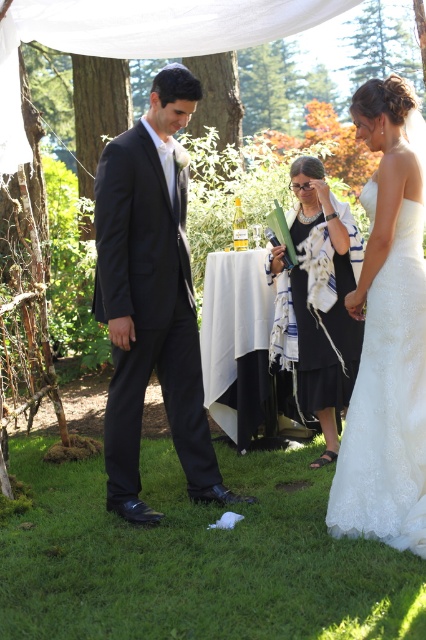
Consider the image. You are standing at the point labeled point (334, 454) and want to move towards the point labeled point (382, 260). Which direction should you move in relation to the other point?

You should move forward towards point (382, 260) because it is in front of point (334, 454).

Based on the scene description, which object is positioned closer to the observer between the matte black suit at center and the white textured shawl at center?

The matte black suit at center is closer to the viewer than the white textured shawl at center according to the description.

Based on the photo, you are a photographer standing at the center of the garden, and you want to take a photo of the two points mentioned in the scene. Which point is closer to you, point (365, 141) or point (394, 336)?

Point (365, 141) is closer to you than point (394, 336) because it is further to the viewer according to the description.